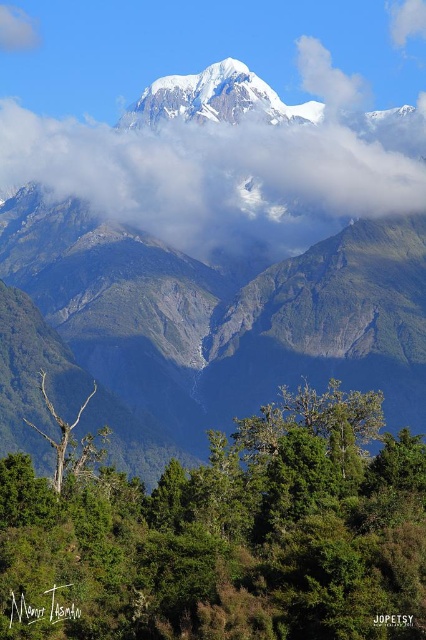
Question: From the image, what is the correct spatial relationship of snowy granite mountain range at upper center in relation to white fluffy cloud at upper center?

Choices:
 (A) right
 (B) left

Answer: (B)

Question: Is white fluffy cloud at upper center above bare wood tree at lower left?

Choices:
 (A) no
 (B) yes

Answer: (B)

Question: Which of these objects is positioned closest to the bare wood tree at lower left?

Choices:
 (A) snowy granite mountain range at upper center
 (B) green leafy tree at lower center

Answer: (A)

Question: Which object appears farthest from the camera in this image?

Choices:
 (A) snowy granite mountain range at upper center
 (B) white fluffy cloud at upper center
 (C) green leafy tree at lower center
 (D) bare wood tree at lower left

Answer: (B)

Question: Which point is closer to the camera taking this photo?

Choices:
 (A) (259, 538)
 (B) (256, 360)
 (C) (57, 481)

Answer: (A)

Question: Does green leafy tree at lower center appear over white fluffy cloud at upper center?

Choices:
 (A) no
 (B) yes

Answer: (A)